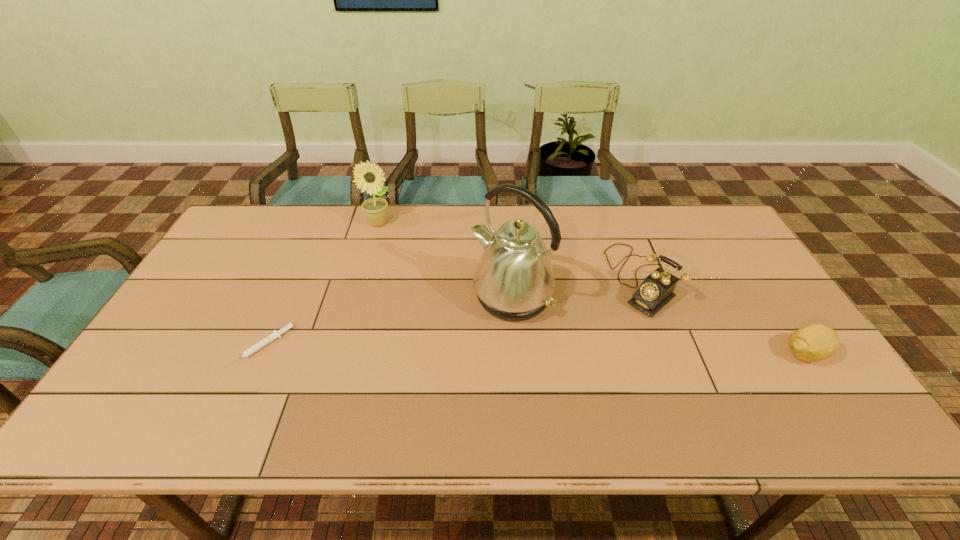
Select which object is the third closest to the second shortest object. Please provide its 2D coordinates. Your answer should be formatted as a tuple, i.e. [(x, y)], where the tuple contains the x and y coordinates of a point satisfying the conditions above.

[(369, 176)]

Locate an element on the screen. The width and height of the screenshot is (960, 540). object that is the third closest to the tallest object is located at coordinates (275, 334).

The width and height of the screenshot is (960, 540). Find the location of `free point that satisfies the following two spatial constraints: 1. on the front side of the leftmost object; 2. at the stem end of the rightmost object`. free point that satisfies the following two spatial constraints: 1. on the front side of the leftmost object; 2. at the stem end of the rightmost object is located at coordinates (260, 354).

At what (x,y) coordinates should I click in order to perform the action: click on vacant space that satisfies the following two spatial constraints: 1. on the front side of the shortest object; 2. at the stem end of the fourth tallest object. Please return your answer as a coordinate pair (x, y). Looking at the image, I should click on (260, 354).

Locate an element on the screen. This screenshot has width=960, height=540. free location that satisfies the following two spatial constraints: 1. on the back side of the telephone; 2. on the right side of the leftmost object is located at coordinates (294, 279).